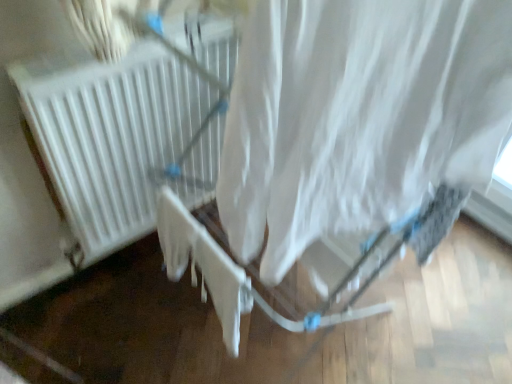
Question: From the image's perspective, relative to white matte radiator at center, is white fabric curtain at center above or below?

Choices:
 (A) above
 (B) below

Answer: (B)

Question: Is white fabric curtain at center wider or thinner than white matte radiator at center?

Choices:
 (A) thin
 (B) wide

Answer: (B)

Question: From their relative heights in the image, would you say white fabric curtain at center is taller or shorter than white matte radiator at center?

Choices:
 (A) short
 (B) tall

Answer: (A)

Question: From the image's perspective, is white matte radiator at center positioned above or below white fabric curtain at center?

Choices:
 (A) above
 (B) below

Answer: (A)

Question: Based on their positions, is white matte radiator at center located to the left or right of white fabric curtain at center?

Choices:
 (A) left
 (B) right

Answer: (A)

Question: Is white matte radiator at center in front of or behind white fabric curtain at center in the image?

Choices:
 (A) front
 (B) behind

Answer: (B)

Question: Does point (156, 158) appear closer or farther from the camera than point (409, 188)?

Choices:
 (A) closer
 (B) farther

Answer: (B)